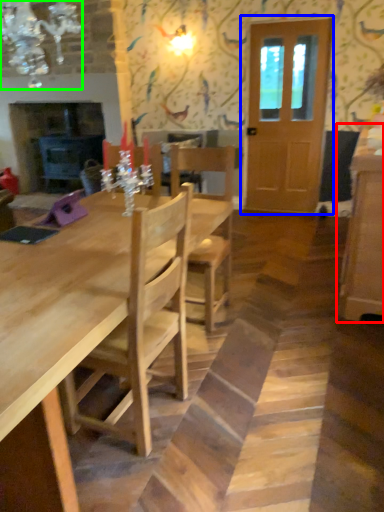
Question: Based on their relative distances, which object is nearer to cabinetry (highlighted by a red box)? Choose from door (highlighted by a blue box) and light fixture (highlighted by a green box).

Choices:
 (A) door
 (B) light fixture

Answer: (A)